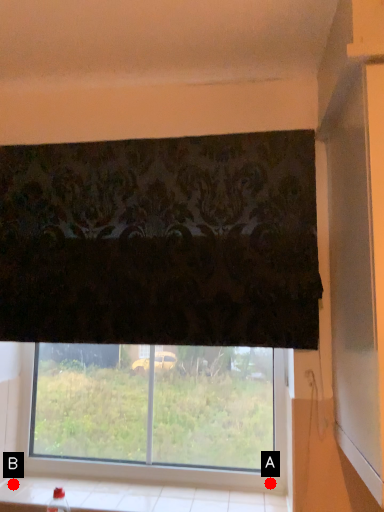
Question: Two points are circled on the image, labeled by A and B beside each circle. Which of the following is the closest to the observer?

Choices:
 (A) A is closer
 (B) B is closer

Answer: (A)